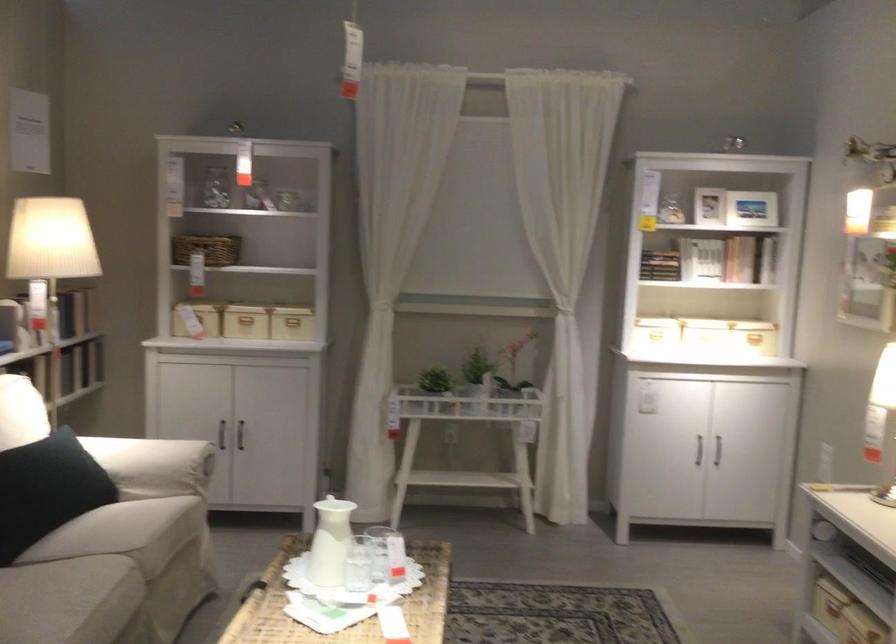
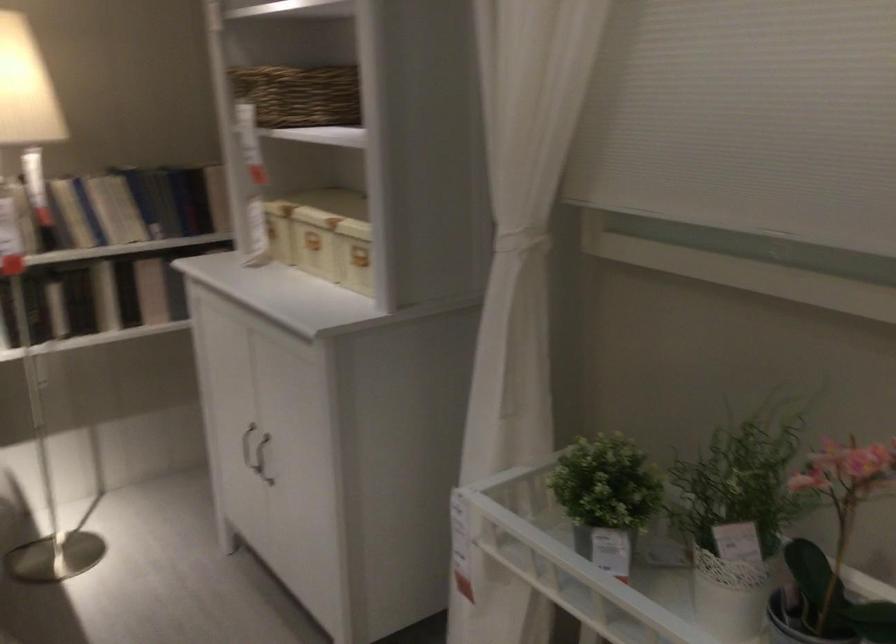
In the second image, find the point that corresponds to point 211,314 in the first image.

(270, 230)